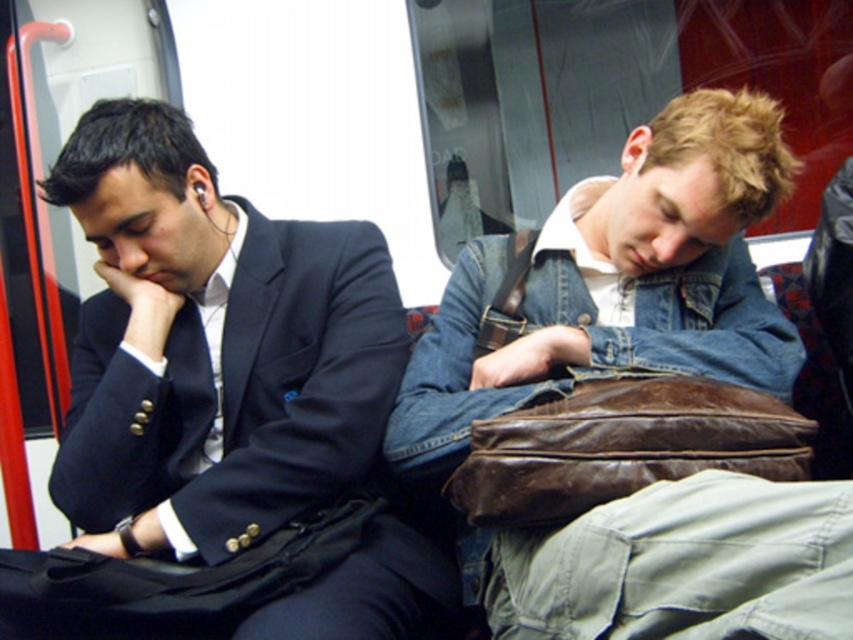
You are a delivery robot that needs to pass between the matte black suit at left and the denim jacket at center. Your body is 12 inches wide. Can you fit through the space between them?

The space between the matte black suit at left and the denim jacket at center is 11.83 inches, which is narrower than the robot body width of 12 inches. Therefore, the robot cannot fit through the space between them.

You are a photographer trying to capture a candid shot of both the matte black suit at left and the denim jacket at center from the front of the vehicle. Given their positions, which subject should you focus on first to ensure both are in frame?

The matte black suit at left is to the left of denim jacket at center, so you should focus on the matte black suit at left first to ensure both are in frame.

You are a photographer trying to capture a candid shot of both the matte black suit at left and the denim jacket at center from the back of the vehicle. Considering their heights, which one might block the other from your view?

The matte black suit at left is taller than the denim jacket at center, so it might block the denim jacket at center from your view.